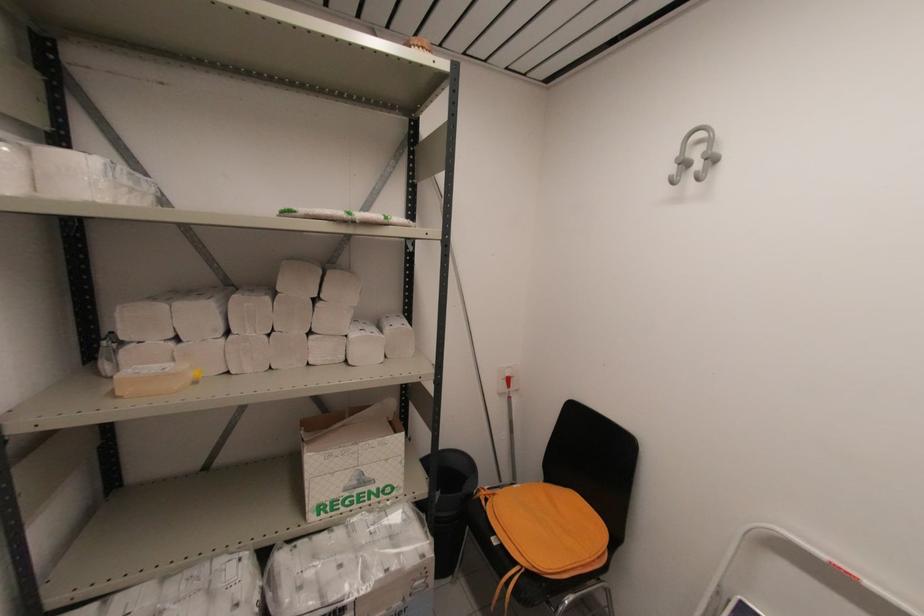
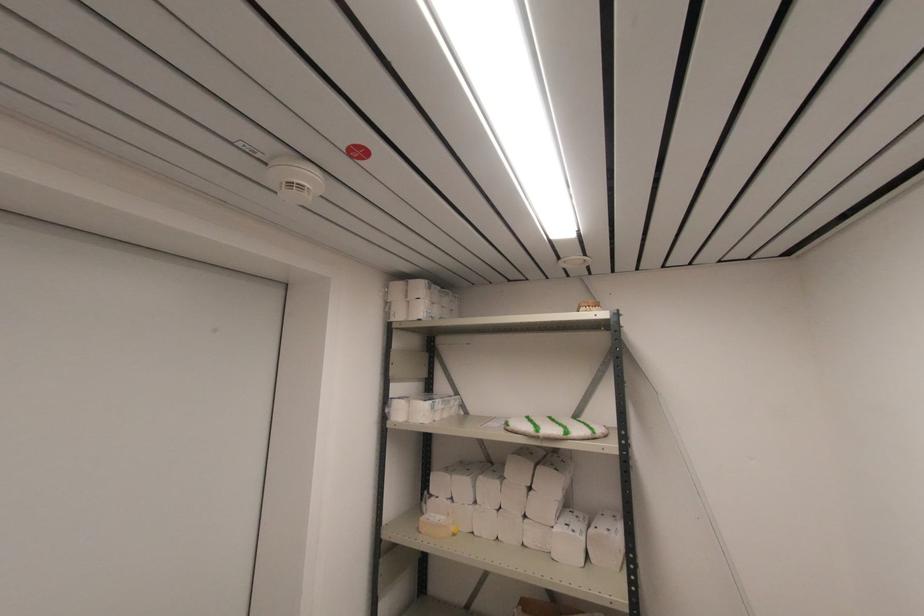
In the second image, find the point that corresponds to [423,50] in the first image.

(590, 307)